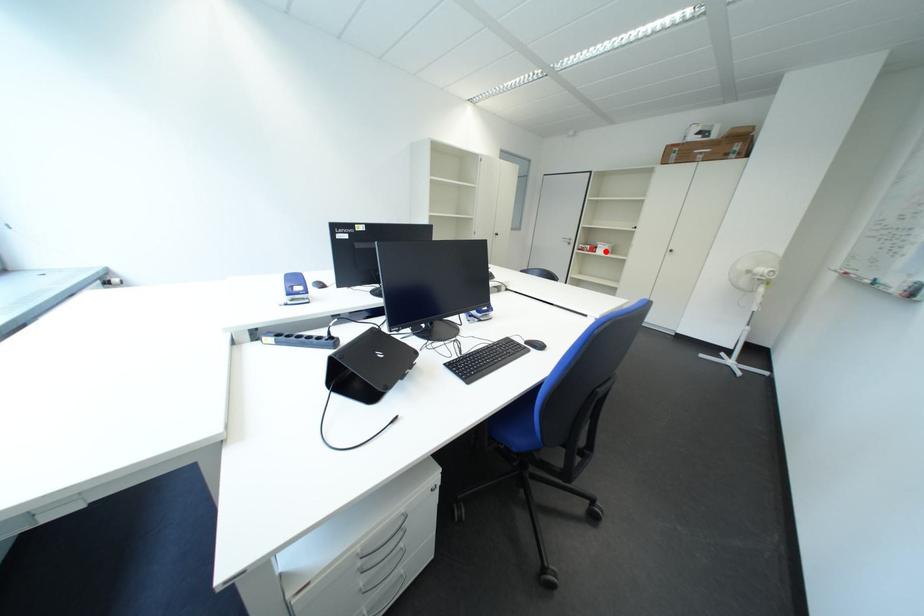
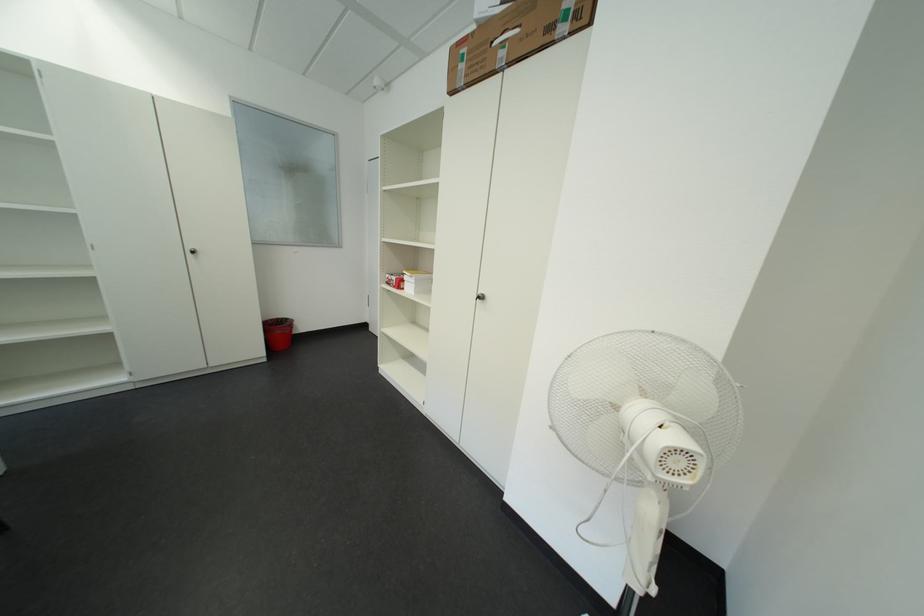
Locate, in the second image, the point that corresponds to the highlighted location in the first image.

(411, 286)